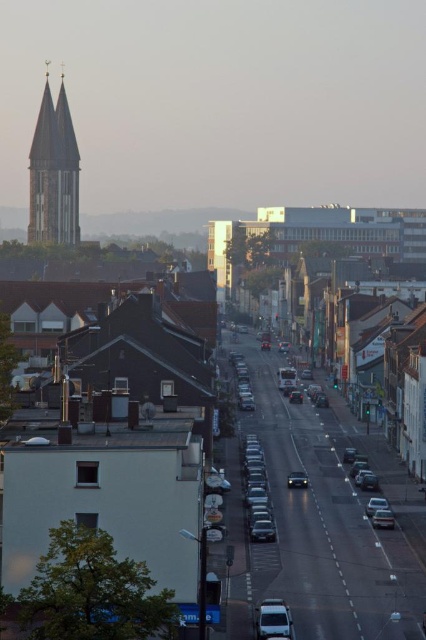
Question: Can you confirm if shiny metallic car at center is bigger than silver metallic van at center?

Choices:
 (A) no
 (B) yes

Answer: (B)

Question: Is shiny metallic car at center closer to the viewer compared to shiny silver sedan at center?

Choices:
 (A) yes
 (B) no

Answer: (A)

Question: Among these objects, which one is nearest to the camera?

Choices:
 (A) shiny metallic car at center
 (B) metallic silver car at lower right
 (C) dark gray stone tower at left
 (D) metallic silver sedan at center

Answer: (A)

Question: Which of the following is the closest to the observer?

Choices:
 (A) shiny metallic car at center
 (B) metallic silver car at lower right

Answer: (A)

Question: Which of these objects is positioned farthest from the dark gray stone tower at left?

Choices:
 (A) shiny metallic car at center
 (B) shiny silver sedan at center
 (C) silver metallic van at center
 (D) metallic silver car at lower right

Answer: (C)

Question: Is silver metallic van at center bigger than shiny silver sedan at center?

Choices:
 (A) no
 (B) yes

Answer: (A)